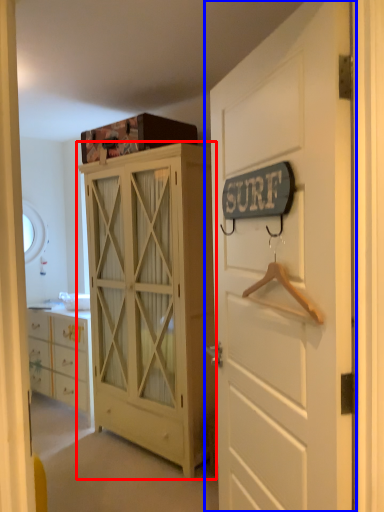
Question: Which object is further to the camera taking this photo, cabinetry (highlighted by a red box) or door (highlighted by a blue box)?

Choices:
 (A) cabinetry
 (B) door

Answer: (A)